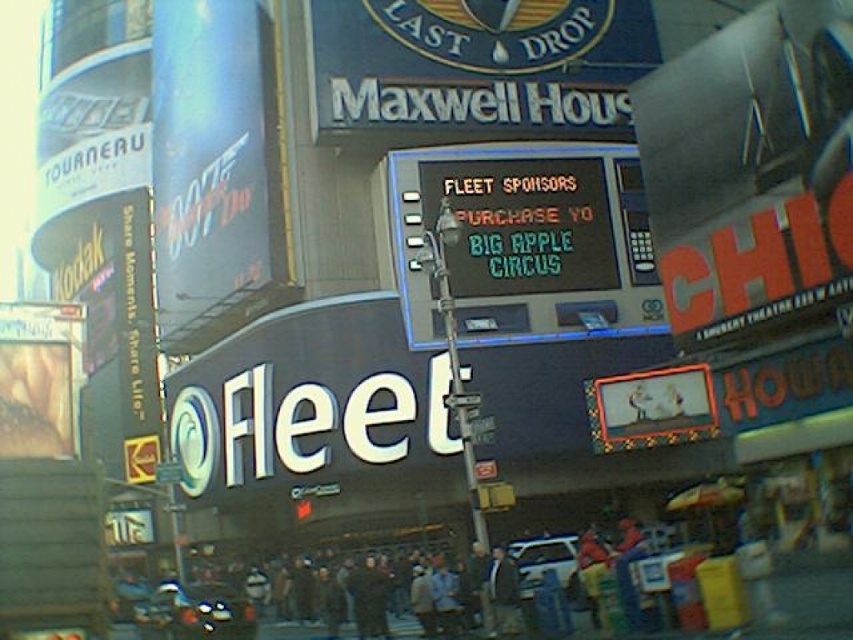
You are a photographer planning to capture the black digital sign at center and the white matte car at center in the same frame. Given their sizes, which object will appear larger in the photo?

The black digital sign at center is much taller than the white matte car at center, so it will appear larger in the photo.